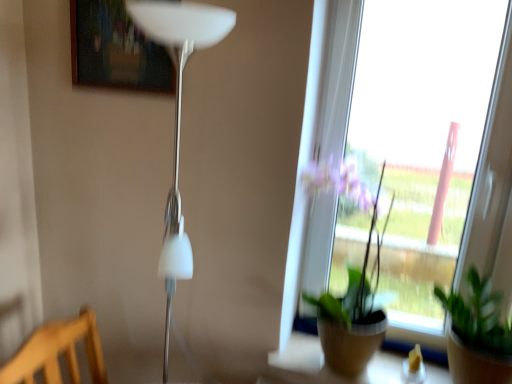
Question: Choose the correct answer: Is green matte plant at lower right, arranged as the 1th houseplant when viewed from the right, inside white glossy floor lamp at left or outside it?

Choices:
 (A) inside
 (B) outside

Answer: (B)

Question: Is green matte plant at lower right, arranged as the 1th houseplant when viewed from the right, bigger or smaller than white glossy floor lamp at left?

Choices:
 (A) big
 (B) small

Answer: (B)

Question: Estimate the real-world distances between objects in this image. Which object is farther from the wooden chair at lower left?

Choices:
 (A) green matte plant at lower right, the second houseplant positioned from the left
 (B) wooden frame at upper center
 (C) green matte plant at center, the 2th houseplant from the right
 (D) white glossy floor lamp at left

Answer: (A)

Question: Which object is positioned farthest from the wooden chair at lower left?

Choices:
 (A) white glossy floor lamp at left
 (B) green matte plant at center, the 2th houseplant from the right
 (C) green matte plant at lower right, the second houseplant positioned from the left
 (D) wooden frame at upper center

Answer: (C)